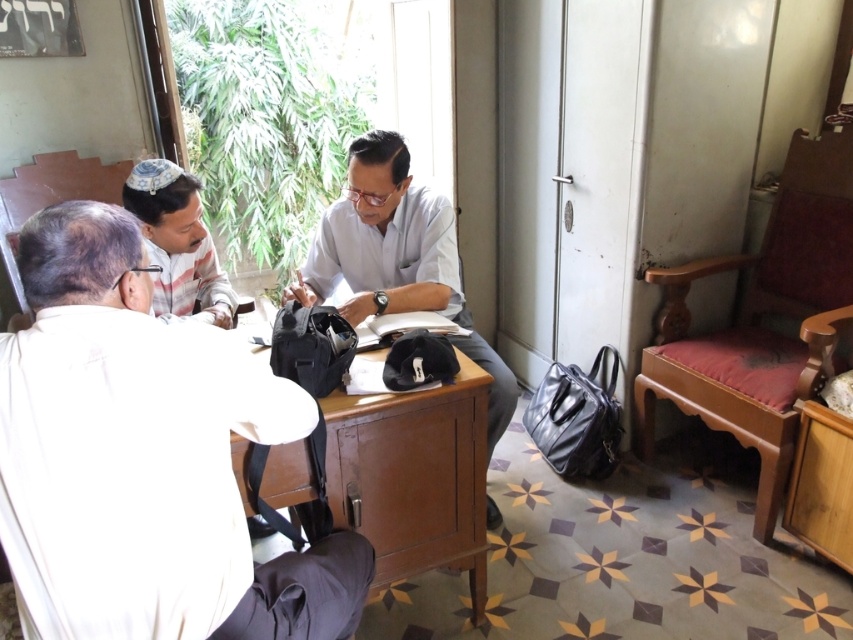
Question: Considering the relative positions of wooden desk at center and white matte shirt at center in the image provided, where is wooden desk at center located with respect to white matte shirt at center?

Choices:
 (A) right
 (B) left

Answer: (B)

Question: Which point appears farthest from the camera in this image?

Choices:
 (A) (339, 474)
 (B) (190, 273)

Answer: (B)

Question: Can you confirm if white matte shirt at left is positioned to the right of white matte shirt at center?

Choices:
 (A) yes
 (B) no

Answer: (B)

Question: Among these objects, which one is nearest to the camera?

Choices:
 (A) wooden desk at center
 (B) white matte shirt at left
 (C) white cloth at upper left
 (D) white matte shirt at center

Answer: (B)

Question: Which object is closer to the camera taking this photo?

Choices:
 (A) white matte shirt at center
 (B) white matte shirt at left
 (C) white cloth at upper left

Answer: (B)

Question: Considering the relative positions of white matte shirt at left and white cloth at upper left in the image provided, where is white matte shirt at left located with respect to white cloth at upper left?

Choices:
 (A) left
 (B) right

Answer: (B)